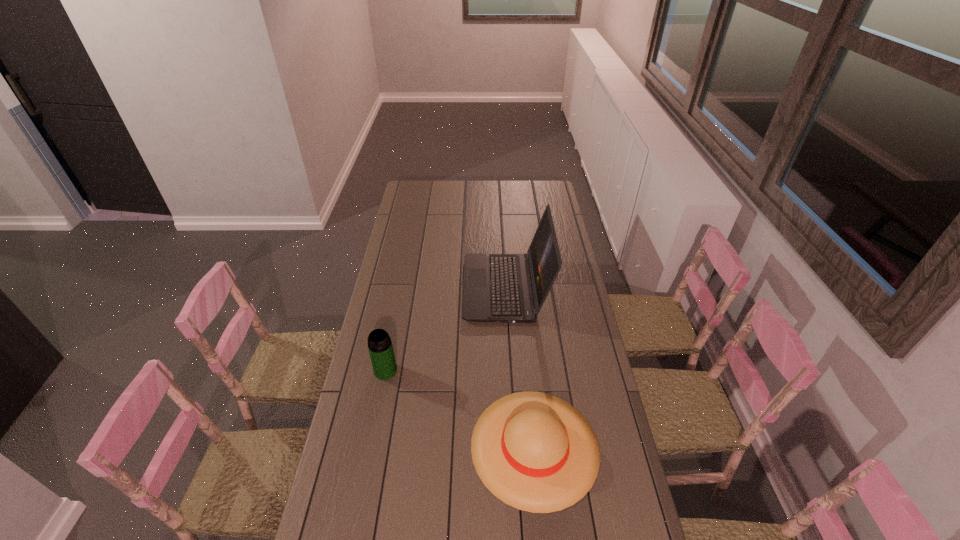
This screenshot has height=540, width=960. I want to click on laptop_computer, so click(x=512, y=288).

This screenshot has height=540, width=960. I want to click on the farthest object, so click(x=512, y=288).

I want to click on the second tallest object, so click(380, 347).

Locate an element on the screen. The height and width of the screenshot is (540, 960). the leftmost object is located at coordinates (380, 347).

The image size is (960, 540). In order to click on the shortest object in this screenshot , I will do `click(534, 451)`.

What are the coordinates of `sombrero` in the screenshot? It's located at (534, 451).

What are the coordinates of `vacant region located 0.100m on the screen of the tallest object` in the screenshot? It's located at (441, 289).

At what (x,y) coordinates should I click in order to perform the action: click on vacant space situated on the screen of the tallest object. Please return your answer as a coordinate pair (x, y). Looking at the image, I should click on [x=436, y=289].

Image resolution: width=960 pixels, height=540 pixels. Identify the location of free spot located on the screen of the tallest object. (385, 289).

Where is `vacant space located from the spout of the leftmost object`? Image resolution: width=960 pixels, height=540 pixels. vacant space located from the spout of the leftmost object is located at coordinates (373, 431).